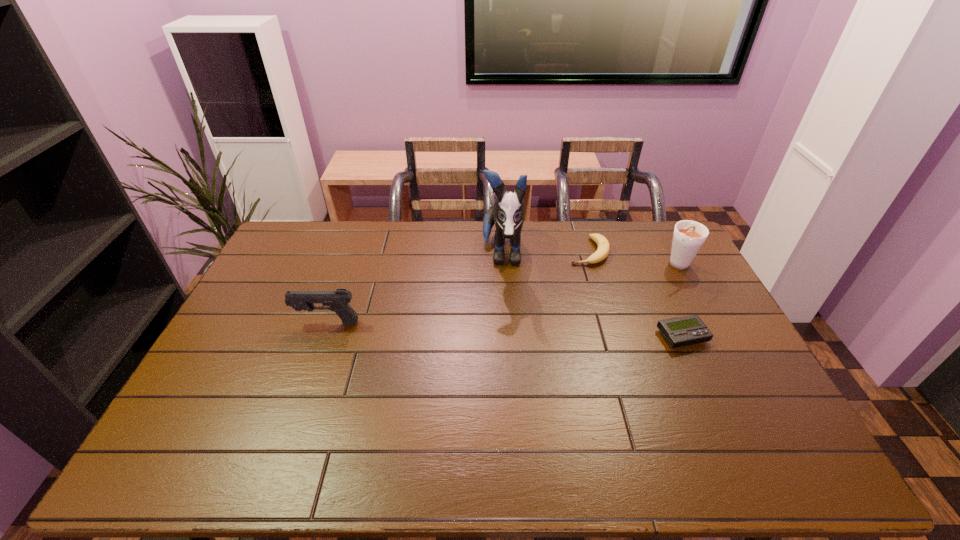
What are the coordinates of `the leftmost object` in the screenshot? It's located at (338, 300).

Image resolution: width=960 pixels, height=540 pixels. What are the coordinates of `the third tallest object` in the screenshot? It's located at (338, 300).

Find the location of a particular element. Image resolution: width=960 pixels, height=540 pixels. beeper is located at coordinates (683, 331).

Where is `the second object from left to right`? the second object from left to right is located at coordinates [x=507, y=212].

What are the coordinates of `puppy` in the screenshot? It's located at (507, 212).

The height and width of the screenshot is (540, 960). Find the location of `banana`. banana is located at coordinates (603, 249).

Identify the location of root beer. The height and width of the screenshot is (540, 960). (688, 237).

Locate an element on the screen. The width and height of the screenshot is (960, 540). free region located 0.180m at the barrel of the third tallest object is located at coordinates (237, 322).

This screenshot has width=960, height=540. I want to click on vacant region located 0.190m at the barrel of the third tallest object, so click(234, 322).

Where is `vacant space situated at the barrel of the third tallest object`? The height and width of the screenshot is (540, 960). vacant space situated at the barrel of the third tallest object is located at coordinates (276, 322).